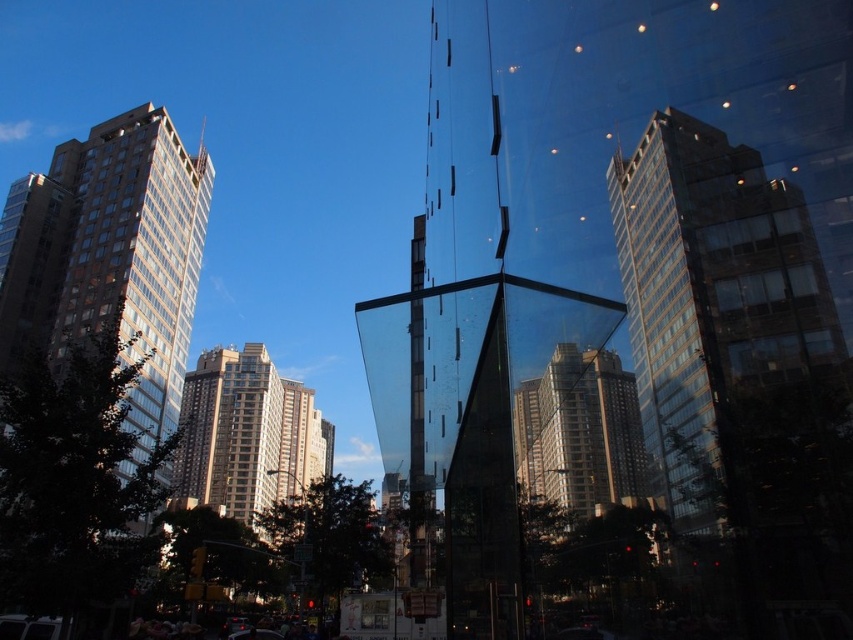
Question: Is clear glass building at center to the left of matte glass building at center from the viewer's perspective?

Choices:
 (A) yes
 (B) no

Answer: (B)

Question: Can you confirm if clear glass building at center is positioned to the right of beige glass building at center?

Choices:
 (A) no
 (B) yes

Answer: (B)

Question: Among these objects, which one is nearest to the camera?

Choices:
 (A) clear glass building at center
 (B) brown glass building at left
 (C) beige glass building at center
 (D) matte glass building at center

Answer: (A)

Question: Considering the relative positions of clear glass building at center and beige glass building at center in the image provided, where is clear glass building at center located with respect to beige glass building at center?

Choices:
 (A) below
 (B) above

Answer: (B)

Question: Estimate the real-world distances between objects in this image. Which object is farther from the clear glass building at center?

Choices:
 (A) matte glass building at center
 (B) brown glass building at left
 (C) beige glass building at center

Answer: (C)

Question: Which point is farther to the camera?

Choices:
 (A) clear glass building at center
 (B) brown glass building at left
 (C) matte glass building at center
 (D) beige glass building at center

Answer: (D)